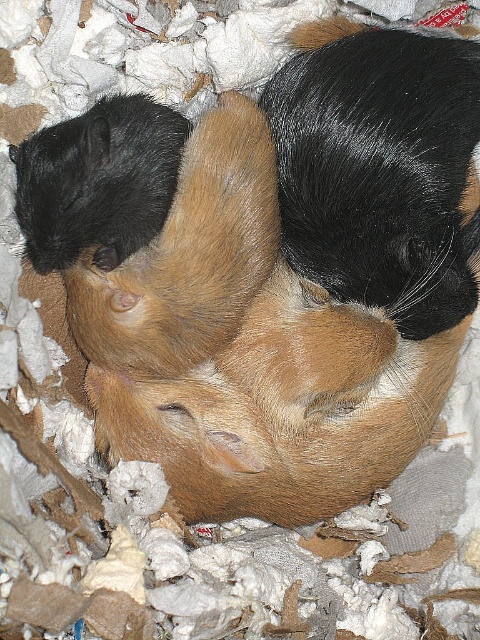
Is point (144, 348) more distant than point (122, 164)?

Yes.

This screenshot has height=640, width=480. In order to click on brown fuzzy guinea pig at center in this screenshot , I will do `click(188, 256)`.